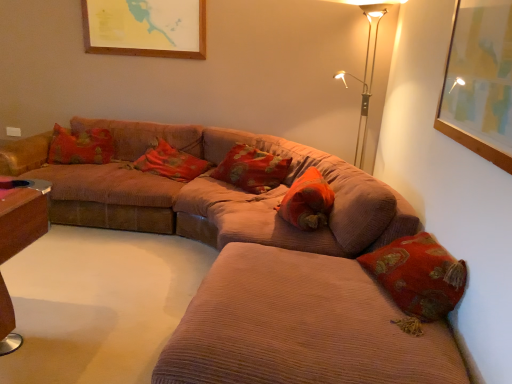
Question: From a real-world perspective, is red velvet cushion at center, which is the third pillow from left to right, physically above metallic gold floor lamp at upper right?

Choices:
 (A) yes
 (B) no

Answer: (B)

Question: Can you confirm if red velvet cushion at center, which is the third pillow from left to right, is wider than metallic gold floor lamp at upper right?

Choices:
 (A) no
 (B) yes

Answer: (A)

Question: From the image's perspective, does red velvet cushion at center, which is the first pillow from right to left, appear higher than metallic gold floor lamp at upper right?

Choices:
 (A) yes
 (B) no

Answer: (B)

Question: Is red velvet cushion at center, which is the third pillow from left to right, smaller than metallic gold floor lamp at upper right?

Choices:
 (A) no
 (B) yes

Answer: (B)

Question: Considering the relative positions of red velvet cushion at center, which is the third pillow from left to right, and metallic gold floor lamp at upper right in the image provided, is red velvet cushion at center, which is the third pillow from left to right, in front of metallic gold floor lamp at upper right?

Choices:
 (A) yes
 (B) no

Answer: (A)

Question: Is point (315, 306) closer or farther from the camera than point (367, 99)?

Choices:
 (A) farther
 (B) closer

Answer: (B)

Question: Is corduroy couch at lower right to the left or to the right of metallic gold floor lamp at upper right in the image?

Choices:
 (A) right
 (B) left

Answer: (B)

Question: Looking at their shapes, would you say corduroy couch at lower right is wider or thinner than metallic gold floor lamp at upper right?

Choices:
 (A) thin
 (B) wide

Answer: (B)

Question: From their relative heights in the image, would you say corduroy couch at lower right is taller or shorter than metallic gold floor lamp at upper right?

Choices:
 (A) tall
 (B) short

Answer: (B)

Question: In the image, is corduroy couch at lower right positioned in front of or behind red velvet cushion at center, which is the first pillow from right to left?

Choices:
 (A) behind
 (B) front

Answer: (B)

Question: In the image, is corduroy couch at lower right on the left side or the right side of red velvet cushion at center, which is the first pillow from right to left?

Choices:
 (A) left
 (B) right

Answer: (A)

Question: From the image's perspective, is corduroy couch at lower right located above or below red velvet cushion at center, which is the third pillow from left to right?

Choices:
 (A) above
 (B) below

Answer: (B)

Question: From their relative heights in the image, would you say corduroy couch at lower right is taller or shorter than red velvet cushion at center, which is the third pillow from left to right?

Choices:
 (A) tall
 (B) short

Answer: (A)

Question: Based on their positions, is red velvet cushion at center, which is the third pillow from left to right, located to the left or right of metallic gold floor lamp at upper right?

Choices:
 (A) left
 (B) right

Answer: (A)

Question: From the image's perspective, relative to metallic gold floor lamp at upper right, is red velvet cushion at center, which is the third pillow from left to right, above or below?

Choices:
 (A) above
 (B) below

Answer: (B)